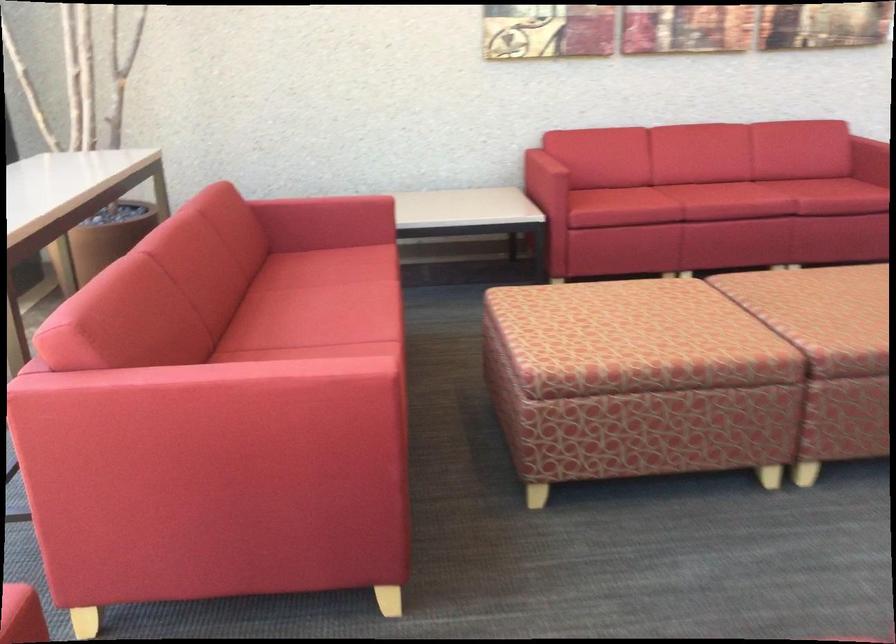
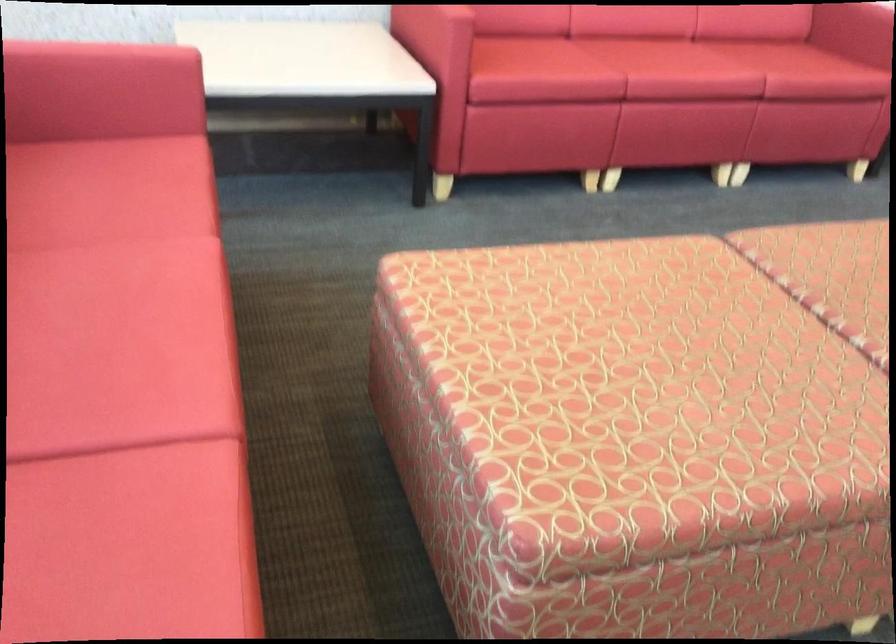
Where in the second image is the point corresponding to (x=467, y=399) from the first image?

(333, 424)